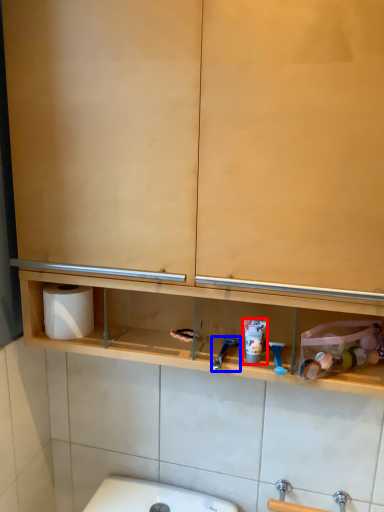
Question: Which object appears farthest to the camera in this image, shaving cream (highlighted by a red box) or shower (highlighted by a blue box)?

Choices:
 (A) shaving cream
 (B) shower

Answer: (A)